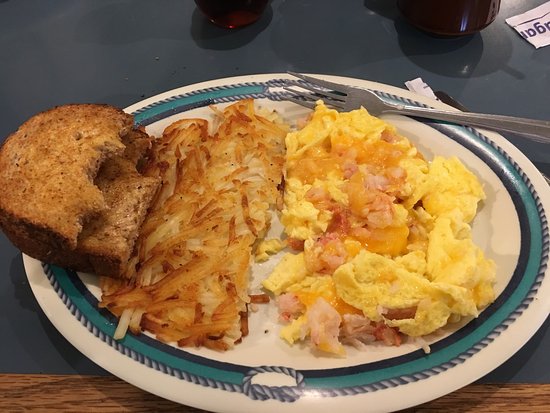
You are a GUI agent. You are given a task and a screenshot of the screen. Output one action in this format:
    pyautogui.click(x=<x>, y=<y>)
    Task: Click on the plate
    The image size is (550, 413).
    Given the screenshot: What is the action you would take?
    pyautogui.click(x=494, y=171)